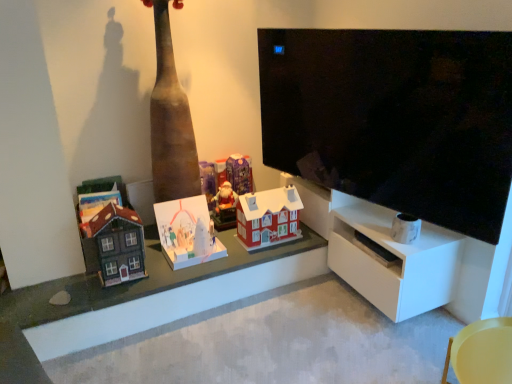
Question: Does wooden toy houses at center have a lesser width compared to yellow plastic chair at lower right?

Choices:
 (A) no
 (B) yes

Answer: (A)

Question: Is wooden toy houses at center behind yellow plastic chair at lower right?

Choices:
 (A) yes
 (B) no

Answer: (A)

Question: Can you confirm if wooden toy houses at center is shorter than yellow plastic chair at lower right?

Choices:
 (A) no
 (B) yes

Answer: (B)

Question: From the image's perspective, is wooden toy houses at center on yellow plastic chair at lower right?

Choices:
 (A) no
 (B) yes

Answer: (B)

Question: Does wooden toy houses at center have a greater width compared to yellow plastic chair at lower right?

Choices:
 (A) yes
 (B) no

Answer: (A)

Question: Can you see wooden toy houses at center touching yellow plastic chair at lower right?

Choices:
 (A) no
 (B) yes

Answer: (A)

Question: Could you tell me if matte brown wooden house at left, the first toy viewed from the left, is facing white cardboard advent calendar at center, the 2th toy in the left-to-right sequence?

Choices:
 (A) no
 (B) yes

Answer: (A)

Question: Does matte brown wooden house at left, the first toy viewed from the left, have a larger size compared to white cardboard advent calendar at center, the 2th toy in the left-to-right sequence?

Choices:
 (A) yes
 (B) no

Answer: (B)

Question: From the image's perspective, is matte brown wooden house at left, which appears as the 5th toy when viewed from the right, below white cardboard advent calendar at center, the 2th toy in the left-to-right sequence?

Choices:
 (A) yes
 (B) no

Answer: (A)

Question: Is matte brown wooden house at left, which appears as the 5th toy when viewed from the right, located outside white cardboard advent calendar at center, marked as the 4th toy in a right-to-left arrangement?

Choices:
 (A) yes
 (B) no

Answer: (A)

Question: Is matte brown wooden house at left, which appears as the 5th toy when viewed from the right, positioned behind white cardboard advent calendar at center, marked as the 4th toy in a right-to-left arrangement?

Choices:
 (A) no
 (B) yes

Answer: (A)

Question: From a real-world perspective, is matte brown wooden house at left, the first toy viewed from the left, located beneath white cardboard advent calendar at center, the 2th toy in the left-to-right sequence?

Choices:
 (A) yes
 (B) no

Answer: (B)

Question: Is yellow plastic chair at lower right next to matte red plastic house at center, the first toy from the right, and touching it?

Choices:
 (A) no
 (B) yes

Answer: (A)